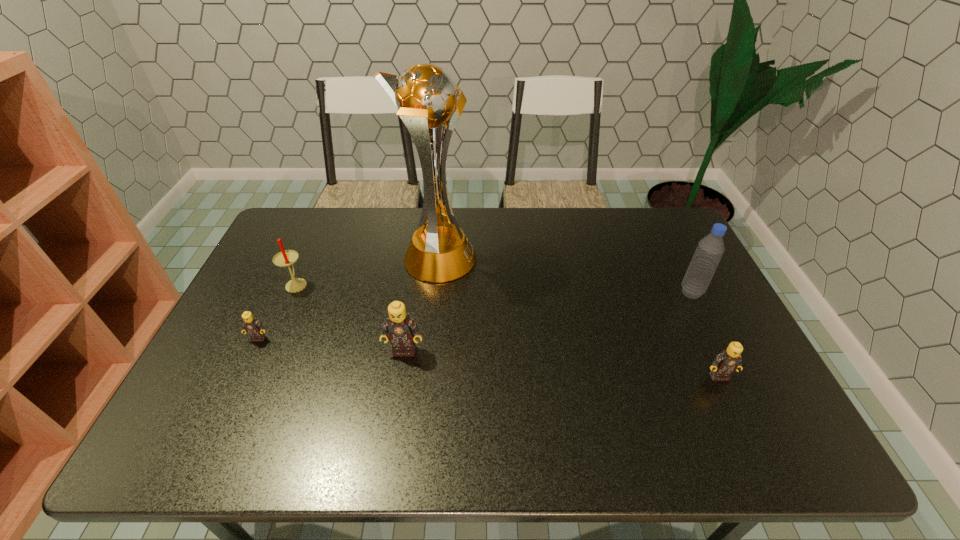
If we want them evenly spaced by inserting an extra Lego among them, please locate a free spot for this new Lego. Please provide its 2D coordinates. Your answer should be formatted as a tuple, i.e. [(x, y)], where the tuple contains the x and y coordinates of a point satisfying the conditions above.

[(558, 363)]